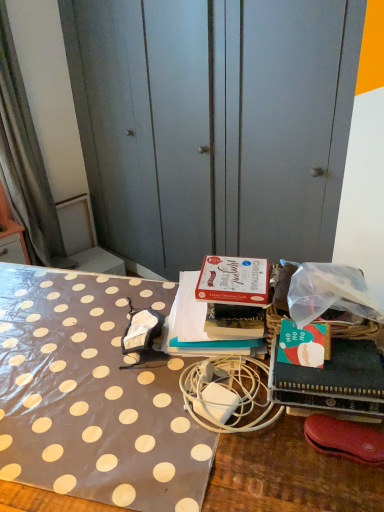
Where is `vacant space that is to the left of white matte charger at center`? vacant space that is to the left of white matte charger at center is located at coordinates (129, 406).